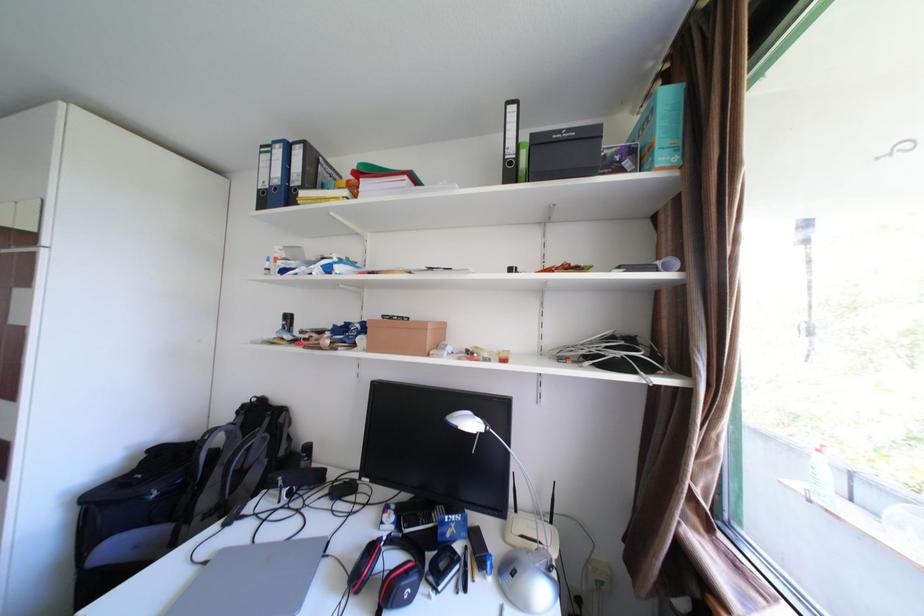
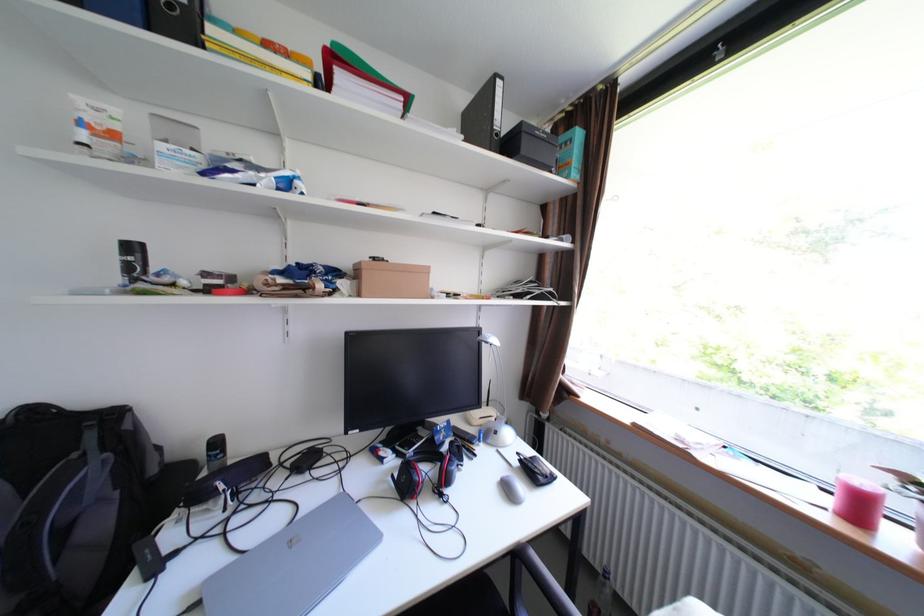
In the second image, find the point that corresponds to pixel 521 163 in the first image.

(507, 135)